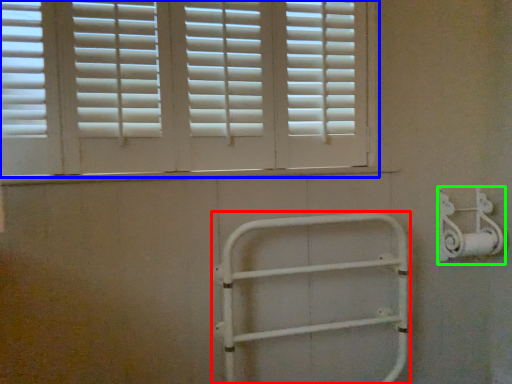
Question: Which is nearer to the rail (highlighted by a red box)? window (highlighted by a blue box) or metal (highlighted by a green box).

Choices:
 (A) window
 (B) metal

Answer: (B)